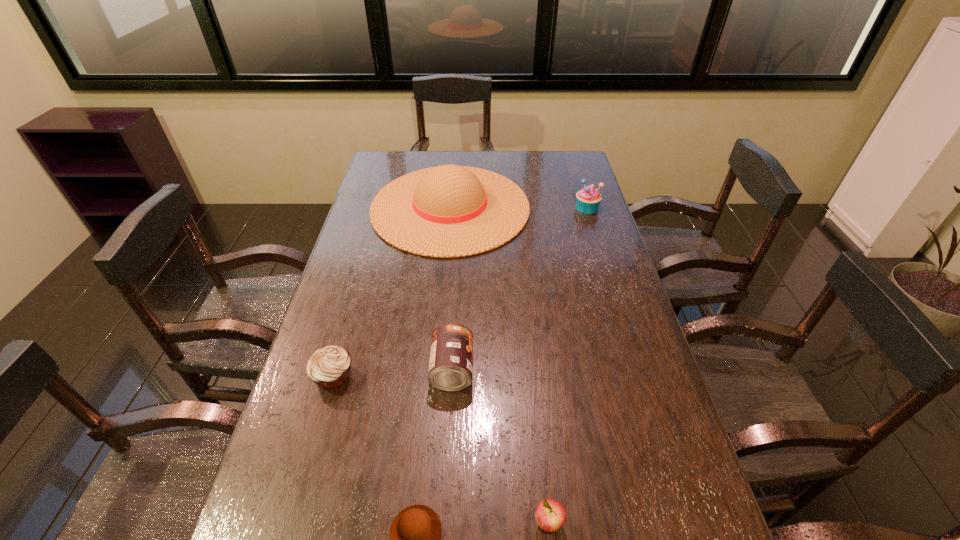
This screenshot has width=960, height=540. Find the location of `vacant area situated on the right of the second shortest muffin`. vacant area situated on the right of the second shortest muffin is located at coordinates (430, 375).

In order to click on vacant space located on the left of the apple in this screenshot , I will do `click(376, 522)`.

You are a GUI agent. You are given a task and a screenshot of the screen. Output one action in this format:
    pyautogui.click(x=<x>, y=<y>)
    Task: Click on the object at the far edge
    
    Given the screenshot: What is the action you would take?
    pyautogui.click(x=450, y=211)

Where is `bonnet at the left edge`? The height and width of the screenshot is (540, 960). bonnet at the left edge is located at coordinates (450, 211).

Find the location of a particular element. The image size is (960, 540). muffin that is at the left edge is located at coordinates (329, 367).

The height and width of the screenshot is (540, 960). I want to click on object that is at the right edge, so click(x=588, y=199).

Identify the location of object at the far left corner. (450, 211).

Locate an element on the screen. The width and height of the screenshot is (960, 540). blank area at the far edge is located at coordinates (545, 174).

Where is `free space at the left edge of the desktop`? This screenshot has width=960, height=540. free space at the left edge of the desktop is located at coordinates coord(372,243).

In the image, there is a desktop. Where is `free space at the right edge`? This screenshot has height=540, width=960. free space at the right edge is located at coordinates (556, 202).